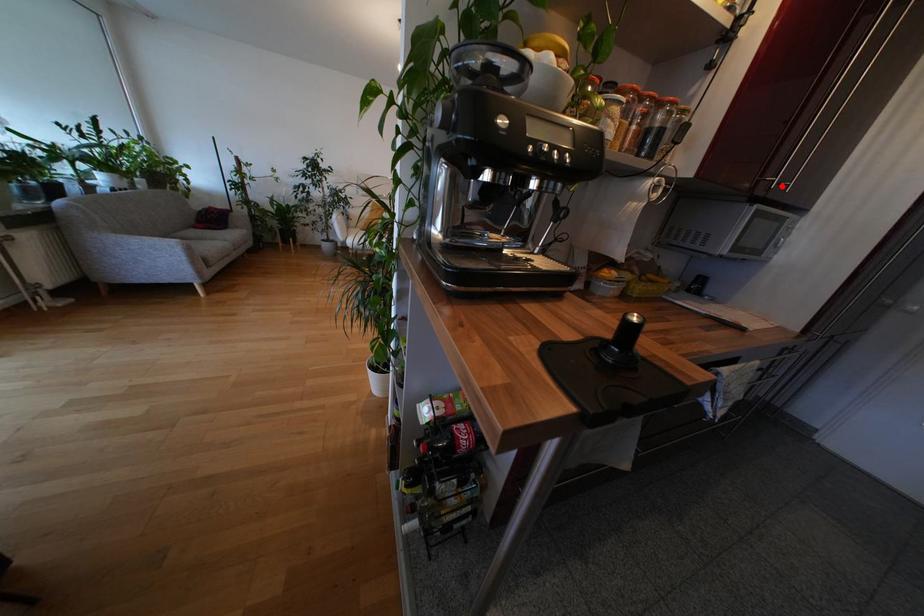
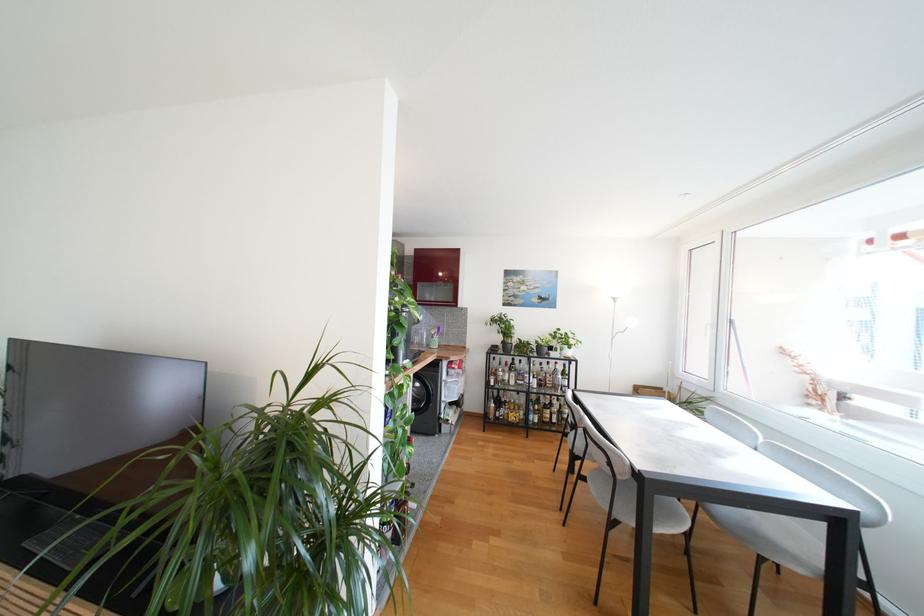
Question: I am providing you with two images of the same scene from different viewpoints. A red point is marked on the first image. At the location where the point appears in image 1, is it still visible in image 2?

Choices:
 (A) Yes
 (B) No

Answer: (B)